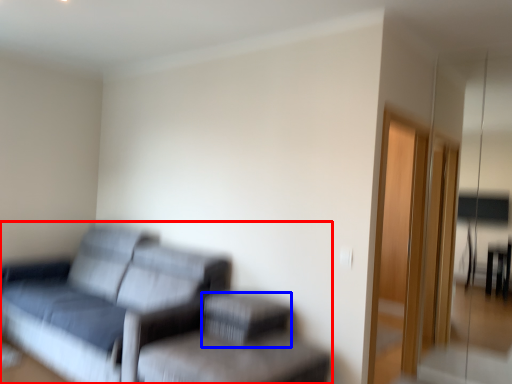
Question: Which of the following is the closest to the observer, studio couch (highlighted by a red box) or footrest (highlighted by a blue box)?

Choices:
 (A) studio couch
 (B) footrest

Answer: (A)